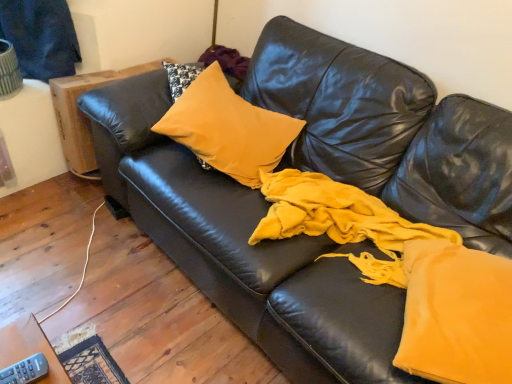
Question: Looking at the image, does wooden side table at left seem bigger or smaller compared to mustard velvet pillow at center?

Choices:
 (A) big
 (B) small

Answer: (A)

Question: Relative to mustard velvet pillow at center, is wooden side table at left in front or behind?

Choices:
 (A) front
 (B) behind

Answer: (B)

Question: Estimate the real-world distances between objects in this image. Which object is closer to the mustard velvet pillow at center?

Choices:
 (A) wooden side table at left
 (B) gray plastic remote at lower left

Answer: (A)

Question: Considering the real-world distances, which object is closest to the gray plastic remote at lower left?

Choices:
 (A) mustard velvet pillow at center
 (B) wooden side table at left

Answer: (A)